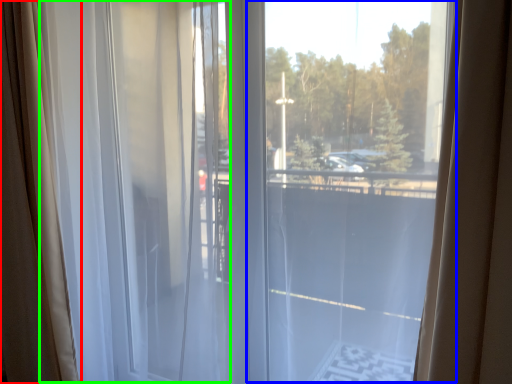
Question: Based on their relative distances, which object is farther from curtain (highlighted by a red box)? Choose from glass window (highlighted by a blue box) and curtain (highlighted by a green box).

Choices:
 (A) glass window
 (B) curtain

Answer: (A)